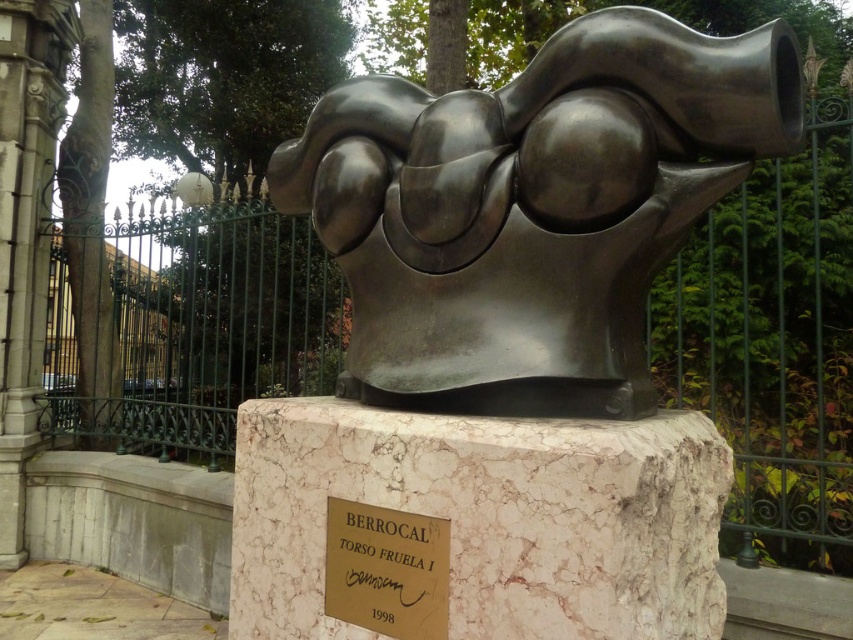
Question: Estimate the real-world distances between objects in this image. Which object is closer to the shiny bronze torso at center?

Choices:
 (A) white marble plaque at center
 (B) gold metallic plaque at center

Answer: (A)

Question: Does shiny bronze torso at center come in front of white marble plaque at center?

Choices:
 (A) yes
 (B) no

Answer: (B)

Question: Based on their relative distances, which object is farther from the white marble plaque at center?

Choices:
 (A) gold metallic plaque at center
 (B) shiny bronze torso at center

Answer: (B)

Question: Which object is positioned farthest from the white marble plaque at center?

Choices:
 (A) shiny bronze torso at center
 (B) gold metallic plaque at center

Answer: (A)

Question: Can you confirm if shiny bronze torso at center is positioned below white marble plaque at center?

Choices:
 (A) no
 (B) yes

Answer: (A)

Question: Considering the relative positions of shiny bronze torso at center and white marble plaque at center in the image provided, where is shiny bronze torso at center located with respect to white marble plaque at center?

Choices:
 (A) left
 (B) right

Answer: (B)